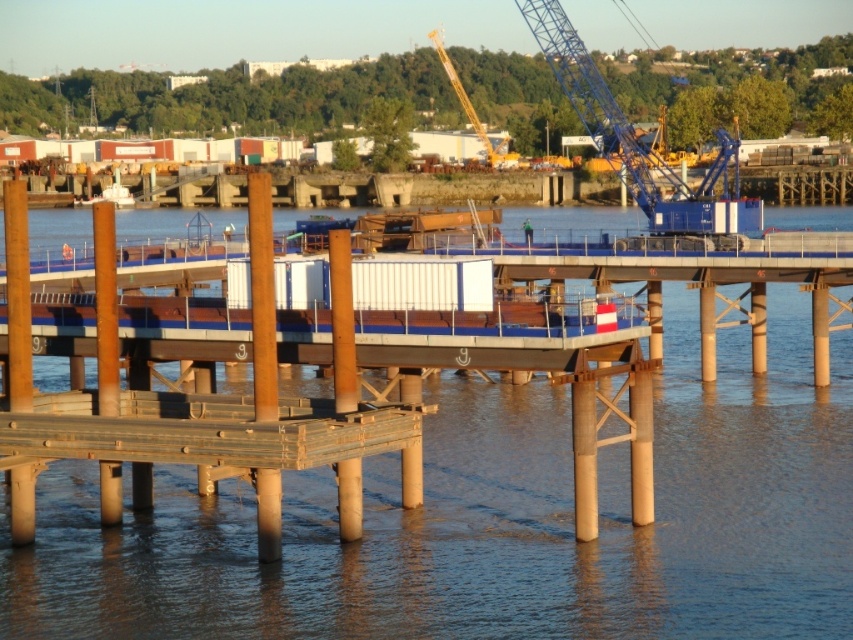
You are a safety inspector standing on the shore and need to assess the brown wooden water at center. Given that your safety regulations require you to stay at least 100 feet away from any construction area, are you currently within a safe distance?

The brown wooden water at center is 98.10 feet away from the viewer. Since the required safe distance is 100 feet, you are currently 1.9 feet too close to the construction area and need to move back further for safety.

You are standing at the construction site and want to determine the relative positions of two points marked on the image. Which of the two points, point (634, 211) or point (500, 145), is closer to your viewpoint?

Point (634, 211) is closer to the camera than point (500, 145).

You are a construction worker standing on the brown wooden water at center. You need to reach the yellow metallic crane at upper center to operate it. Can you walk directly to the crane from your current position? Explain why or why not based on the distance provided.

The distance between the brown wooden water at center and the yellow metallic crane at upper center is 66.40 meters. Since the crane is located at a significant distance away, you would need to traverse this distance, which may require moving through the construction site, possibly over the pier or around the barge. However, the direct path might not be feasible due to obstacles like scattered materials or equipment, but the straight line distance is 66.40 meters.